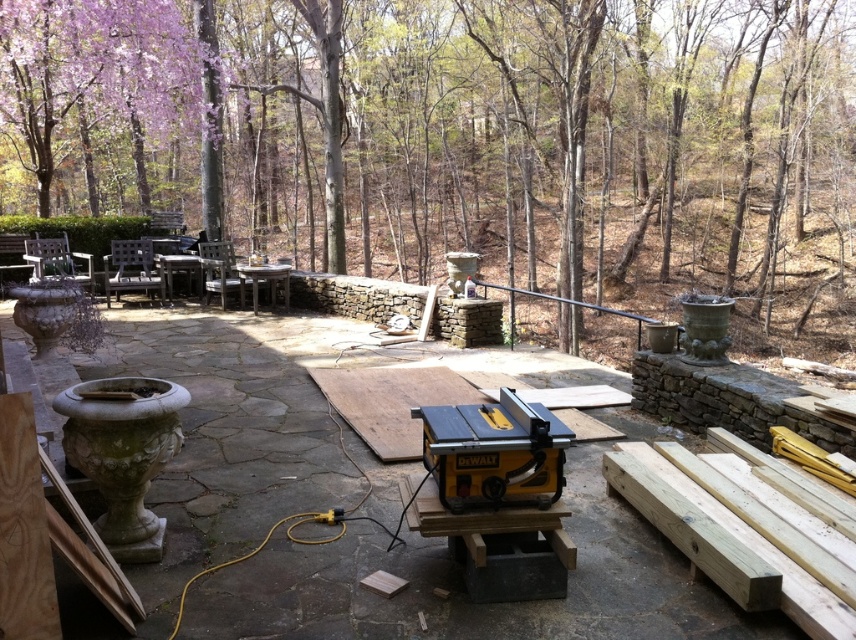
You are a contractor working on the patio and need to move the yellow plastic table saw at center to a location where it won not be obstructed by the brown wood tree at upper center. Which direction should you move it to avoid the tree?

The brown wood tree at upper center is positioned over the yellow plastic table saw at center, so moving the yellow plastic table saw at center to the left or right would place it out from under the tree.